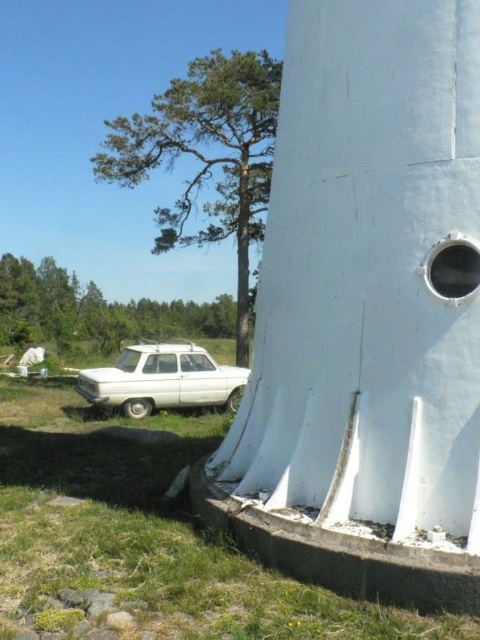
Question: Among these points, which one is nearest to the camera?

Choices:
 (A) (101, 349)
 (B) (417, 257)
 (C) (434, 259)

Answer: (C)

Question: Is green grass at lower left positioned behind green leafy tree at upper left?

Choices:
 (A) yes
 (B) no

Answer: (B)

Question: Which of these objects is positioned farthest from the metallic circular hole at right?

Choices:
 (A) white matte sedan at lower left
 (B) green leafy tree at lower left

Answer: (B)

Question: Observing the image, what is the correct spatial positioning of white matte water tower at lower right in reference to green leafy tree at lower left?

Choices:
 (A) above
 (B) below

Answer: (A)

Question: Which object appears farthest from the camera in this image?

Choices:
 (A) green leafy tree at lower left
 (B) white matte water tower at lower right
 (C) metallic circular hole at right
 (D) white matte sedan at lower left

Answer: (A)

Question: Is green grass at lower left positioned behind metallic circular hole at right?

Choices:
 (A) no
 (B) yes

Answer: (A)